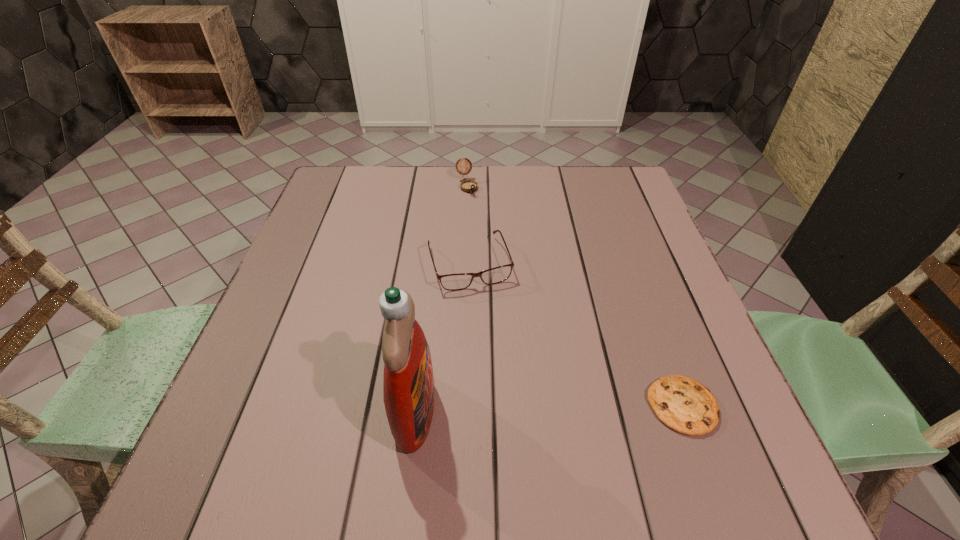
This screenshot has width=960, height=540. In the image, there is a desktop. In order to click on vacant region at the far edge in this screenshot , I will do `click(420, 206)`.

Where is `vacant space at the near edge of the desktop`? The width and height of the screenshot is (960, 540). vacant space at the near edge of the desktop is located at coordinates [479, 412].

Identify the location of vacant region at the left edge of the desktop. This screenshot has width=960, height=540. (292, 272).

The width and height of the screenshot is (960, 540). Identify the location of vacant space at the right edge. (684, 313).

Identify the location of free space at the far left corner. The width and height of the screenshot is (960, 540). (381, 180).

This screenshot has height=540, width=960. In order to click on free spot at the far right corner of the desktop in this screenshot , I will do `click(636, 199)`.

Locate an element on the screen. The height and width of the screenshot is (540, 960). vacant region between the third nearest object and the tallest object is located at coordinates (443, 336).

Locate an element on the screen. free spot between the second shortest object and the farthest object is located at coordinates (468, 225).

You are a GUI agent. You are given a task and a screenshot of the screen. Output one action in this format:
    pyautogui.click(x=<x>, y=<y>)
    Task: Click on the vacant area between the farthest object and the second farthest object
    This screenshot has width=960, height=540.
    Given the screenshot: What is the action you would take?
    pyautogui.click(x=468, y=225)

Where is `vacant area between the shortest object and the detergent`? Image resolution: width=960 pixels, height=540 pixels. vacant area between the shortest object and the detergent is located at coordinates (548, 408).